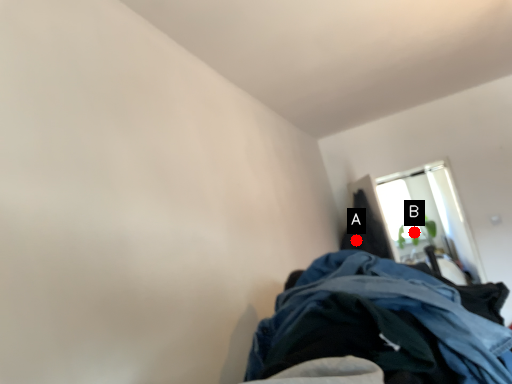
Question: Two points are circled on the image, labeled by A and B beside each circle. Which of the following is the closest to the observer?

Choices:
 (A) A is closer
 (B) B is closer

Answer: (A)